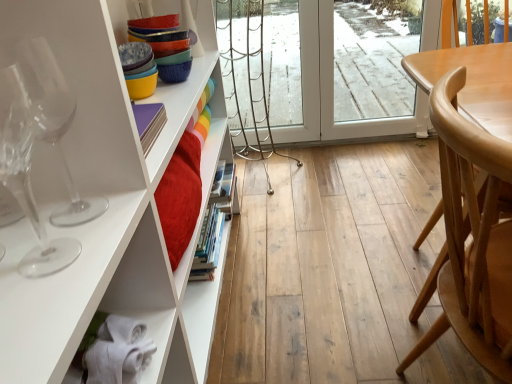
Where is `transparent glass wine glass at left, the first wine glass viewed from the front`? transparent glass wine glass at left, the first wine glass viewed from the front is located at coordinates (27, 177).

This screenshot has width=512, height=384. What do you see at coordinates (55, 123) in the screenshot?
I see `transparent glass wine glass at left, the 1th wine glass when ordered from back to front` at bounding box center [55, 123].

The width and height of the screenshot is (512, 384). In order to click on transparent glass wine glass at left, arranged as the second wine glass when viewed from the back in this screenshot , I will do `click(27, 177)`.

Does transparent glass wine glass at left, the second wine glass in the front-to-back sequence, have a greater height compared to light brown wood chair at right?

Incorrect, the height of transparent glass wine glass at left, the second wine glass in the front-to-back sequence, is not larger of that of light brown wood chair at right.

Is point (73, 213) closer or farther from the camera than point (493, 213)?

Point (73, 213).

From the image's perspective, is transparent glass wine glass at left, the second wine glass in the front-to-back sequence, on light brown wood chair at right?

Yes, from the image's perspective, transparent glass wine glass at left, the second wine glass in the front-to-back sequence, is over light brown wood chair at right.

From the image's perspective, which one is positioned higher, light brown wood chair at right or transparent glass wine glass at left, arranged as the second wine glass when viewed from the back?

transparent glass wine glass at left, arranged as the second wine glass when viewed from the back.

Considering the positions of objects light brown wood chair at right and transparent glass wine glass at left, arranged as the second wine glass when viewed from the back, in the image provided, who is behind, light brown wood chair at right or transparent glass wine glass at left, arranged as the second wine glass when viewed from the back,?

light brown wood chair at right is further away from the camera.

Looking at this image, are light brown wood chair at right and transparent glass wine glass at left, arranged as the second wine glass when viewed from the back, beside each other?

No.

Considering the relative sizes of light brown wood chair at right and transparent glass wine glass at left, arranged as the second wine glass when viewed from the back, in the image provided, is light brown wood chair at right thinner than transparent glass wine glass at left, arranged as the second wine glass when viewed from the back,?

No.

Looking at their sizes, would you say transparent glass wine glass at left, arranged as the second wine glass when viewed from the back, is wider or thinner than light brown wood chair at right?

transparent glass wine glass at left, arranged as the second wine glass when viewed from the back, is thinner than light brown wood chair at right.

Which of these two, transparent glass wine glass at left, the first wine glass viewed from the front, or light brown wood chair at right, stands taller?

With more height is light brown wood chair at right.

From a real-world perspective, is transparent glass wine glass at left, arranged as the second wine glass when viewed from the back, below light brown wood chair at right?

No, from a real-world perspective, transparent glass wine glass at left, arranged as the second wine glass when viewed from the back, is not under light brown wood chair at right.

Are transparent glass wine glass at left, arranged as the second wine glass when viewed from the back, and light brown wood chair at right making contact?

No, transparent glass wine glass at left, arranged as the second wine glass when viewed from the back, is not with light brown wood chair at right.

Is transparent glass wine glass at left, the 1th wine glass when ordered from back to front, in contact with transparent glass wine glass at left, arranged as the second wine glass when viewed from the back?

Yes, transparent glass wine glass at left, the 1th wine glass when ordered from back to front, is right next to transparent glass wine glass at left, arranged as the second wine glass when viewed from the back, and making contact.

Considering the positions of objects transparent glass wine glass at left, the second wine glass in the front-to-back sequence, and transparent glass wine glass at left, arranged as the second wine glass when viewed from the back, in the image provided, who is more to the right, transparent glass wine glass at left, the second wine glass in the front-to-back sequence, or transparent glass wine glass at left, arranged as the second wine glass when viewed from the back,?

From the viewer's perspective, transparent glass wine glass at left, arranged as the second wine glass when viewed from the back, appears more on the right side.

Is transparent glass wine glass at left, the second wine glass in the front-to-back sequence, thinner than transparent glass wine glass at left, arranged as the second wine glass when viewed from the back?

Correct, the width of transparent glass wine glass at left, the second wine glass in the front-to-back sequence, is less than that of transparent glass wine glass at left, arranged as the second wine glass when viewed from the back.

Can we say transparent glass wine glass at left, the 1th wine glass when ordered from back to front, lies outside transparent glass wine glass at left, the first wine glass viewed from the front?

That's correct, transparent glass wine glass at left, the 1th wine glass when ordered from back to front, is outside of transparent glass wine glass at left, the first wine glass viewed from the front.

From a real-world perspective, is transparent glass wine glass at left, the first wine glass viewed from the front, under transparent glass wine glass at left, the second wine glass in the front-to-back sequence?

Yes, from a real-world perspective, transparent glass wine glass at left, the first wine glass viewed from the front, is under transparent glass wine glass at left, the second wine glass in the front-to-back sequence.

Does transparent glass wine glass at left, arranged as the second wine glass when viewed from the back, appear on the right side of transparent glass wine glass at left, the second wine glass in the front-to-back sequence?

Yes, transparent glass wine glass at left, arranged as the second wine glass when viewed from the back, is to the right of transparent glass wine glass at left, the second wine glass in the front-to-back sequence.

Choose the correct answer: Is transparent glass wine glass at left, arranged as the second wine glass when viewed from the back, inside transparent glass wine glass at left, the second wine glass in the front-to-back sequence, or outside it?

transparent glass wine glass at left, arranged as the second wine glass when viewed from the back, lies outside transparent glass wine glass at left, the second wine glass in the front-to-back sequence.

From the image's perspective, is transparent glass wine glass at left, arranged as the second wine glass when viewed from the back, beneath transparent glass wine glass at left, the 1th wine glass when ordered from back to front?

Yes.

The image size is (512, 384). Identify the location of chair located underneath the transparent glass wine glass at left, the 1th wine glass when ordered from back to front (from a real-world perspective). point(472,238).

In terms of size, does light brown wood chair at right appear bigger or smaller than transparent glass wine glass at left, the second wine glass in the front-to-back sequence?

Considering their sizes, light brown wood chair at right takes up more space than transparent glass wine glass at left, the second wine glass in the front-to-back sequence.

Is light brown wood chair at right looking in the opposite direction of transparent glass wine glass at left, the 1th wine glass when ordered from back to front?

Yes.

This screenshot has height=384, width=512. What are the coordinates of `the 2nd wine glass above the light brown wood chair at right (from a real-world perspective)` in the screenshot? It's located at (55, 123).

I want to click on wine glass in front of the light brown wood chair at right, so click(x=27, y=177).

Based on their spatial positions, is light brown wood chair at right or transparent glass wine glass at left, the 1th wine glass when ordered from back to front, closer to transparent glass wine glass at left, the first wine glass viewed from the front?

transparent glass wine glass at left, the 1th wine glass when ordered from back to front, is positioned closer to the anchor transparent glass wine glass at left, the first wine glass viewed from the front.

Considering their positions, is transparent glass wine glass at left, the 1th wine glass when ordered from back to front, positioned closer to transparent glass wine glass at left, the first wine glass viewed from the front, than light brown wood chair at right?

transparent glass wine glass at left, the 1th wine glass when ordered from back to front, is positioned closer to the anchor transparent glass wine glass at left, the first wine glass viewed from the front.

Estimate the real-world distances between objects in this image. Which object is closer to light brown wood chair at right, transparent glass wine glass at left, the 1th wine glass when ordered from back to front, or transparent glass wine glass at left, arranged as the second wine glass when viewed from the back?

transparent glass wine glass at left, the 1th wine glass when ordered from back to front, is positioned closer to the anchor light brown wood chair at right.

Consider the image. When comparing their distances from transparent glass wine glass at left, the 1th wine glass when ordered from back to front, does transparent glass wine glass at left, arranged as the second wine glass when viewed from the back, or light brown wood chair at right seem further?

The object further to transparent glass wine glass at left, the 1th wine glass when ordered from back to front, is light brown wood chair at right.

Estimate the real-world distances between objects in this image. Which object is closer to transparent glass wine glass at left, the second wine glass in the front-to-back sequence, light brown wood chair at right or transparent glass wine glass at left, the first wine glass viewed from the front?

transparent glass wine glass at left, the first wine glass viewed from the front, is positioned closer to the anchor transparent glass wine glass at left, the second wine glass in the front-to-back sequence.

Looking at the image, which one is located closer to light brown wood chair at right, transparent glass wine glass at left, arranged as the second wine glass when viewed from the back, or transparent glass wine glass at left, the second wine glass in the front-to-back sequence?

transparent glass wine glass at left, the second wine glass in the front-to-back sequence.

Find the location of a particular element. The image size is (512, 384). wine glass situated between transparent glass wine glass at left, the 1th wine glass when ordered from back to front, and light brown wood chair at right from left to right is located at coordinates (27, 177).